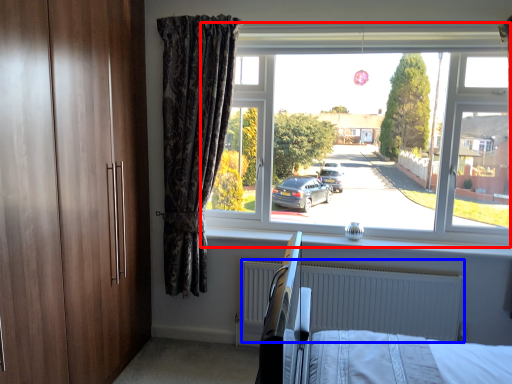
Question: Among these objects, which one is farthest to the camera, window (highlighted by a red box) or radiator (highlighted by a blue box)?

Choices:
 (A) window
 (B) radiator

Answer: (B)